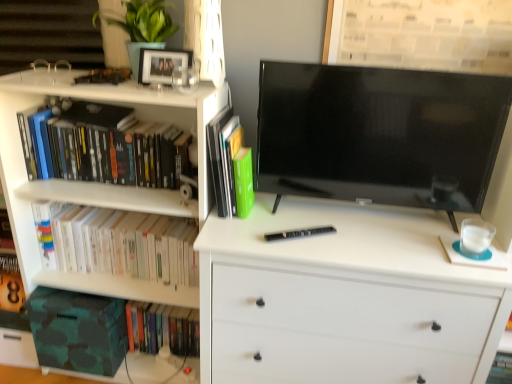
Where is `free point behind black matte pen at center`? Image resolution: width=512 pixels, height=384 pixels. free point behind black matte pen at center is located at coordinates (297, 215).